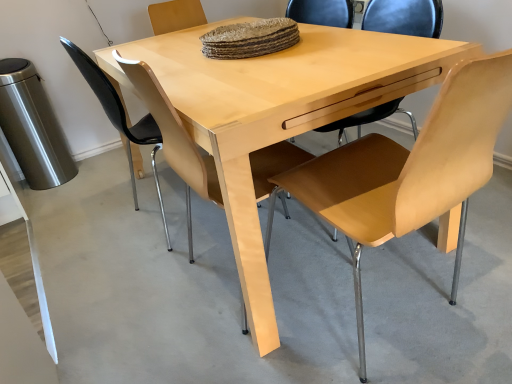
Question: Is light wood chair at center, the second chair in the left-to-right sequence, to the right of light brown wood chair at center, which is counted as the 1th chair, starting from the right, from the viewer's perspective?

Choices:
 (A) yes
 (B) no

Answer: (B)

Question: From a real-world perspective, is light wood chair at center, the second chair in the left-to-right sequence, beneath light brown wood chair at center, which is counted as the 1th chair, starting from the right?

Choices:
 (A) yes
 (B) no

Answer: (B)

Question: Can you confirm if light wood chair at center, the second chair in the left-to-right sequence, is bigger than light brown wood chair at center, the third chair when ordered from left to right?

Choices:
 (A) no
 (B) yes

Answer: (A)

Question: Is light wood chair at center, the second chair in the left-to-right sequence, looking in the opposite direction of light brown wood chair at center, the third chair when ordered from left to right?

Choices:
 (A) yes
 (B) no

Answer: (B)

Question: Is light wood chair at center, the second chair in the left-to-right sequence, touching light brown wood chair at center, which is counted as the 1th chair, starting from the right?

Choices:
 (A) yes
 (B) no

Answer: (B)

Question: Does light wood chair at center, the second chair in the left-to-right sequence, lie behind light brown wood chair at center, which is counted as the 1th chair, starting from the right?

Choices:
 (A) yes
 (B) no

Answer: (A)

Question: Is light wood table at center to the left of light brown leather chair at center, the 3th chair viewed from the right, from the viewer's perspective?

Choices:
 (A) yes
 (B) no

Answer: (B)

Question: Is light wood table at center positioned behind light brown leather chair at center, which is the 1th chair in left-to-right order?

Choices:
 (A) yes
 (B) no

Answer: (B)

Question: Does light wood table at center have a larger size compared to light brown leather chair at center, which is the 1th chair in left-to-right order?

Choices:
 (A) no
 (B) yes

Answer: (B)

Question: Considering the relative sizes of light wood table at center and light brown leather chair at center, the 3th chair viewed from the right, in the image provided, is light wood table at center thinner than light brown leather chair at center, the 3th chair viewed from the right,?

Choices:
 (A) no
 (B) yes

Answer: (A)

Question: From a real-world perspective, is light wood table at center physically below light brown leather chair at center, which is the 1th chair in left-to-right order?

Choices:
 (A) yes
 (B) no

Answer: (A)

Question: Is the position of light wood table at center less distant than that of light brown leather chair at center, the 3th chair viewed from the right?

Choices:
 (A) yes
 (B) no

Answer: (A)

Question: Considering the relative positions of light wood chair at center, which is counted as the second chair, starting from the right, and light brown leather chair at center, which is the 1th chair in left-to-right order, in the image provided, is light wood chair at center, which is counted as the second chair, starting from the right, behind light brown leather chair at center, which is the 1th chair in left-to-right order,?

Choices:
 (A) yes
 (B) no

Answer: (B)